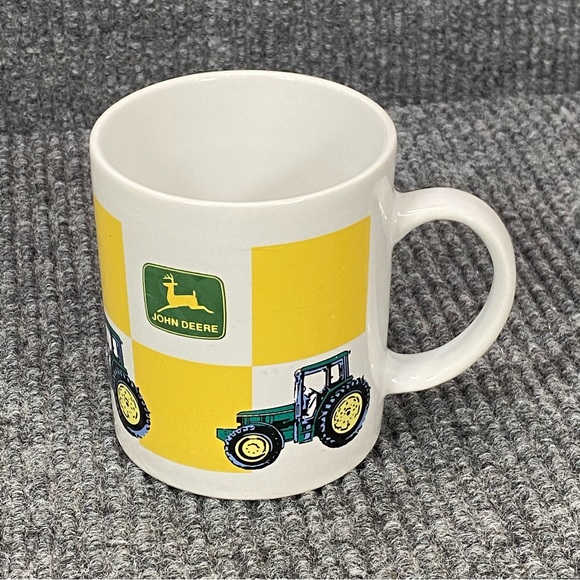
Locate an element on the screen. This screenshot has height=580, width=580. cup is located at coordinates (262, 216).